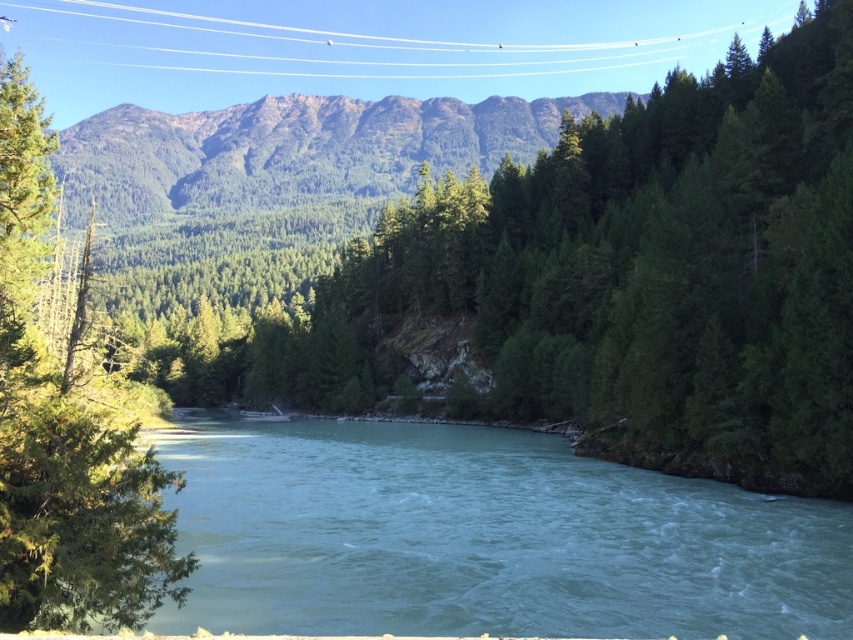
You are a hiker who wants to cross the river using a small boat. The boat can carry you and your gear but requires at least 20 meters of space between the riverbank and the opposite bank to safely navigate. Based on the scene, can you determine if the distance between the turquoise water at center and the green matte tree at left is sufficient for your boat to safely cross the river?

The distance between the turquoise water at center and the green matte tree at left is 20.18 meters, which is just over the required 20 meters. Therefore, the boat can safely navigate the river as the distance is sufficient.

You are standing at the riverside and see the turquoise water at center and the green textured mountain at upper center. Which object is positioned higher in the image?

The green textured mountain at upper center is positioned higher in the image than the turquoise water at center.